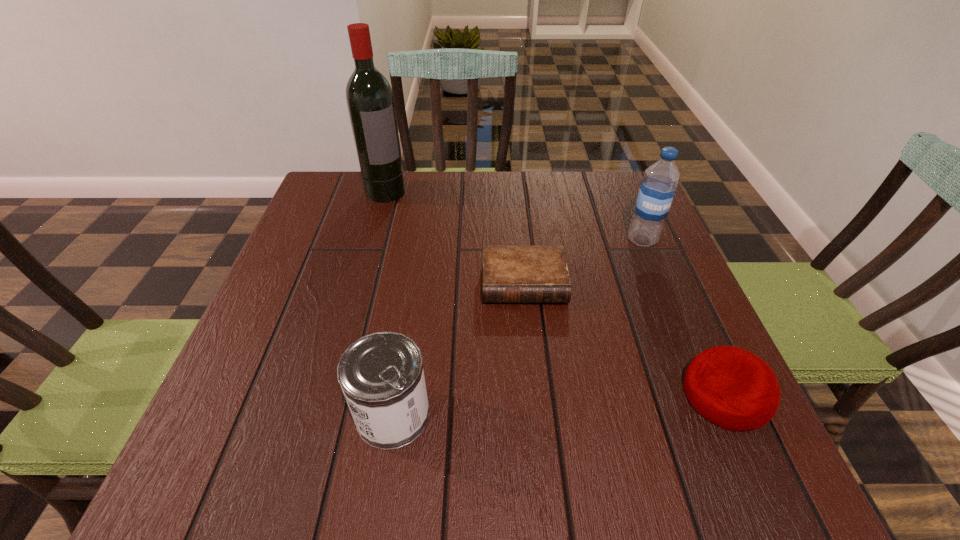
At what (x,y) coordinates should I click in order to perform the action: click on vacant space located 0.390m on the seat area of the second shortest object. Please return your answer as a coordinate pair (x, y). Image resolution: width=960 pixels, height=540 pixels. Looking at the image, I should click on (457, 395).

I want to click on vacant space situated 0.400m on the seat area of the second shortest object, so click(451, 395).

Where is `vacant space located on the spine side of the diary`? vacant space located on the spine side of the diary is located at coordinates (534, 399).

Locate an element on the screen. The height and width of the screenshot is (540, 960). vacant area situated 0.140m on the spine side of the diary is located at coordinates (531, 364).

Identify the location of vacant space positioned on the spine side of the diary. (532, 383).

This screenshot has width=960, height=540. Identify the location of vacant space located on the label of the tallest object. (454, 285).

Where is `free region located 0.240m on the label of the tallest object`? The height and width of the screenshot is (540, 960). free region located 0.240m on the label of the tallest object is located at coordinates (431, 253).

Locate an element on the screen. The image size is (960, 540). vacant space located 0.170m on the label of the tallest object is located at coordinates (419, 237).

Where is `vacant space situated on the label of the water bottle`? vacant space situated on the label of the water bottle is located at coordinates (594, 312).

Where is `vacant space situated on the label of the water bottle`? vacant space situated on the label of the water bottle is located at coordinates (629, 260).